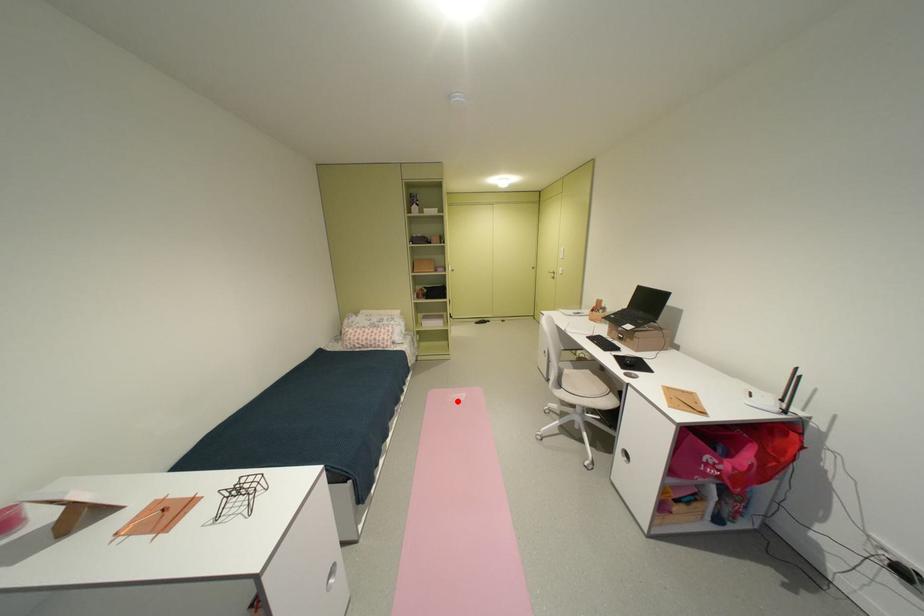
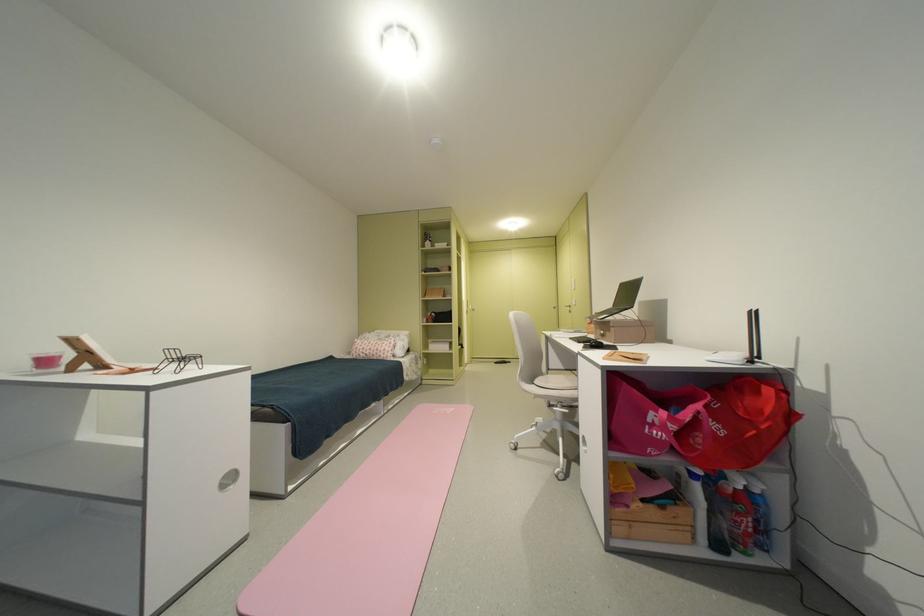
The point at the highlighted location is marked in the first image. Where is the corresponding point in the second image?

(444, 413)